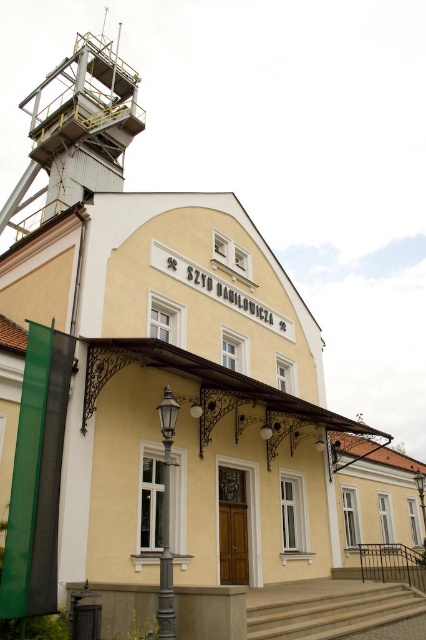
Question: Can you confirm if yellow metallic tower at upper left is positioned to the right of concrete stairs at lower center?

Choices:
 (A) no
 (B) yes

Answer: (A)

Question: Which point is farther to the camera?

Choices:
 (A) yellow metallic tower at upper left
 (B) concrete stairs at lower center

Answer: (A)

Question: Is yellow metallic tower at upper left to the left of concrete stairs at lower center from the viewer's perspective?

Choices:
 (A) no
 (B) yes

Answer: (B)

Question: Which point is closer to the camera?

Choices:
 (A) (127, 106)
 (B) (267, 595)

Answer: (B)

Question: Is yellow metallic tower at upper left in front of concrete stairs at lower center?

Choices:
 (A) no
 (B) yes

Answer: (A)